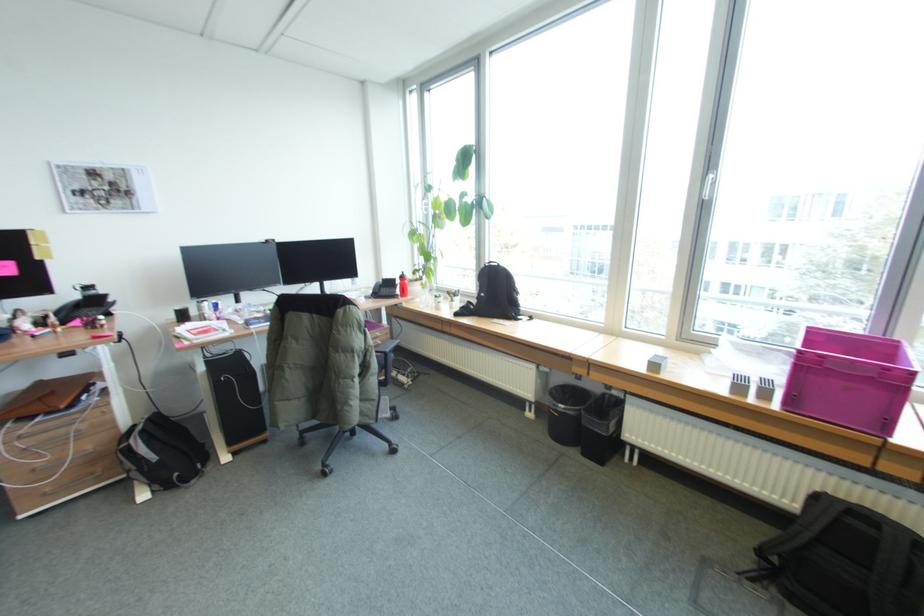
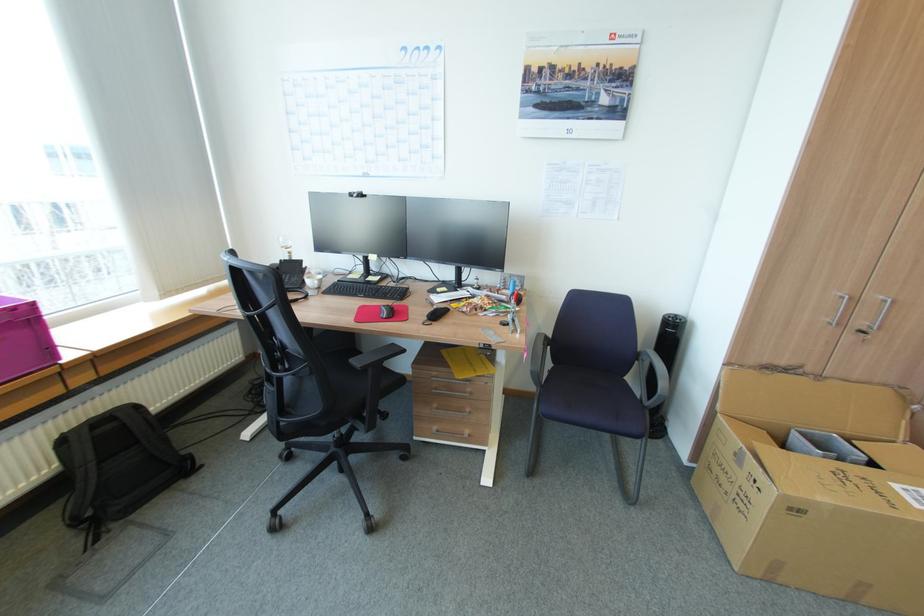
Locate, in the second image, the point that corresponds to point (891, 367) in the first image.

(21, 309)